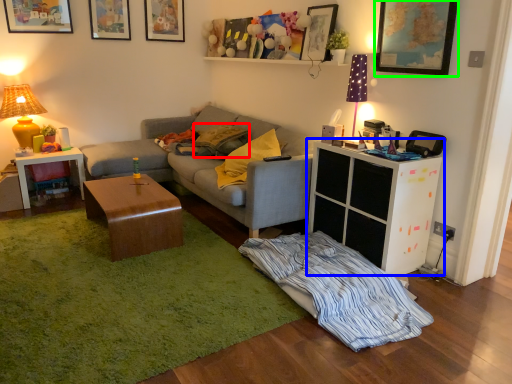
Question: Based on their relative distances, which object is farther from pillow (highlighted by a red box)? Choose from cabinetry (highlighted by a blue box) and picture frame (highlighted by a green box).

Choices:
 (A) cabinetry
 (B) picture frame

Answer: (B)